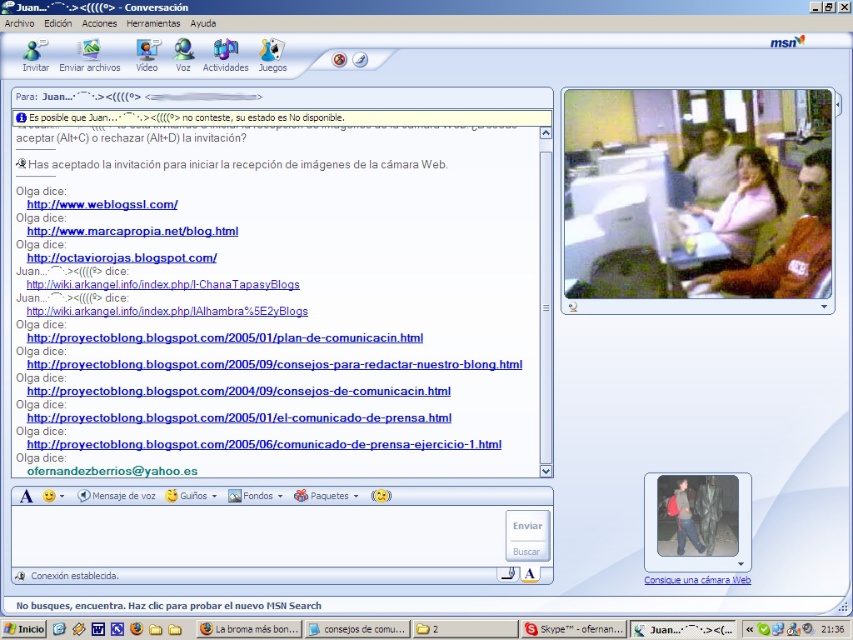
Question: Which point appears closest to the camera in this image?

Choices:
 (A) (776, 193)
 (B) (735, 576)
 (C) (706, 193)

Answer: (B)

Question: Which of these objects is positioned closest to the matte black jacket at center?

Choices:
 (A) white glossy text at bottom center
 (B) white matte shirt at upper center
 (C) pink fabric shirt at upper right

Answer: (A)

Question: Is matte black jacket at center above white glossy text at bottom center?

Choices:
 (A) yes
 (B) no

Answer: (A)

Question: Which point is closer to the camera?

Choices:
 (A) (711, 131)
 (B) (759, 200)
 (C) (715, 488)

Answer: (A)

Question: Is pink fabric shirt at upper right positioned at the back of camouflage pants at lower right?

Choices:
 (A) yes
 (B) no

Answer: (B)

Question: Does pink fabric shirt at upper right appear on the left side of white glossy text at bottom center?

Choices:
 (A) no
 (B) yes

Answer: (A)